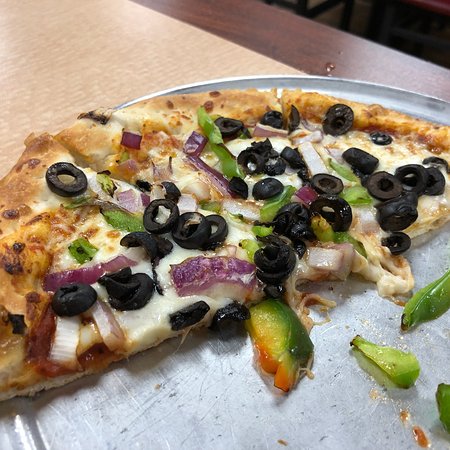
Where is `table`? The width and height of the screenshot is (450, 450). table is located at coordinates (205, 55).